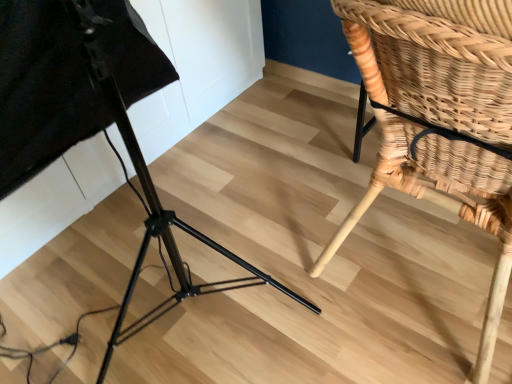
Identify the location of free space underneath woven wood chair at lower right (from a real-world perspective). (419, 267).